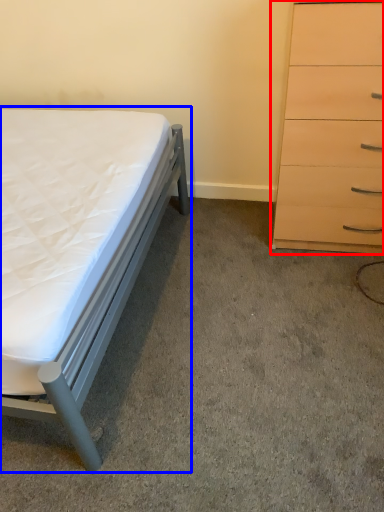
Question: Which of the following is the closest to the observer, chest of drawers (highlighted by a red box) or bed (highlighted by a blue box)?

Choices:
 (A) chest of drawers
 (B) bed

Answer: (B)